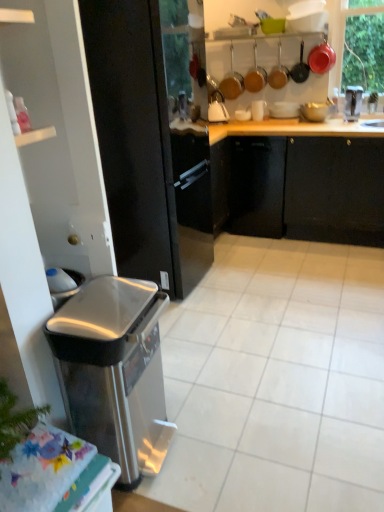
Question: Is matte red pot at upper right, the sixth appliance positioned from the left, taller than white glossy bowl at upper center, the 3th appliance positioned from the left?

Choices:
 (A) no
 (B) yes

Answer: (B)

Question: From a real-world perspective, is matte red pot at upper right, the sixth appliance positioned from the left, positioned over white glossy bowl at upper center, which is the fifth appliance from right to left, based on gravity?

Choices:
 (A) yes
 (B) no

Answer: (A)

Question: Does matte red pot at upper right, marked as the second appliance in a right-to-left arrangement, have a larger size compared to white glossy bowl at upper center, the 3th appliance positioned from the left?

Choices:
 (A) no
 (B) yes

Answer: (B)

Question: Does matte red pot at upper right, marked as the second appliance in a right-to-left arrangement, lie in front of white glossy bowl at upper center, which is the fifth appliance from right to left?

Choices:
 (A) yes
 (B) no

Answer: (A)

Question: Considering the relative positions of matte red pot at upper right, the sixth appliance positioned from the left, and white glossy bowl at upper center, which is the fifth appliance from right to left, in the image provided, is matte red pot at upper right, the sixth appliance positioned from the left, to the right of white glossy bowl at upper center, which is the fifth appliance from right to left, from the viewer's perspective?

Choices:
 (A) yes
 (B) no

Answer: (A)

Question: From the image's perspective, is matte white bowl at upper center, which is counted as the fifth appliance, starting from the left, located above or below metallic copper pot at upper center, arranged as the first appliance when viewed from the left?

Choices:
 (A) above
 (B) below

Answer: (B)

Question: Considering the positions of matte white bowl at upper center, which appears as the 3th appliance when viewed from the right, and metallic copper pot at upper center, arranged as the first appliance when viewed from the left, in the image, is matte white bowl at upper center, which appears as the 3th appliance when viewed from the right, bigger or smaller than metallic copper pot at upper center, arranged as the first appliance when viewed from the left,?

Choices:
 (A) small
 (B) big

Answer: (A)

Question: Considering the positions of point (301, 110) and point (223, 83), is point (301, 110) closer or farther from the camera than point (223, 83)?

Choices:
 (A) farther
 (B) closer

Answer: (B)

Question: From their relative heights in the image, would you say matte white bowl at upper center, which appears as the 3th appliance when viewed from the right, is taller or shorter than metallic copper pot at upper center, arranged as the first appliance when viewed from the left?

Choices:
 (A) tall
 (B) short

Answer: (B)

Question: Based on their positions, is black glossy refrigerator at left located to the left or right of matte brown pot at upper center, positioned as the 2th appliance in left-to-right order?

Choices:
 (A) left
 (B) right

Answer: (A)

Question: Is black glossy refrigerator at left bigger or smaller than matte brown pot at upper center, acting as the sixth appliance starting from the right?

Choices:
 (A) small
 (B) big

Answer: (B)

Question: Is black glossy refrigerator at left situated inside matte brown pot at upper center, acting as the sixth appliance starting from the right, or outside?

Choices:
 (A) inside
 (B) outside

Answer: (B)

Question: Considering the positions of black glossy refrigerator at left and matte brown pot at upper center, acting as the sixth appliance starting from the right, in the image, is black glossy refrigerator at left wider or thinner than matte brown pot at upper center, acting as the sixth appliance starting from the right,?

Choices:
 (A) wide
 (B) thin

Answer: (A)

Question: In the image, is black glossy refrigerator at left positioned in front of or behind white glossy sink at upper right?

Choices:
 (A) front
 (B) behind

Answer: (A)

Question: From the image's perspective, is black glossy refrigerator at left above or below white glossy sink at upper right?

Choices:
 (A) below
 (B) above

Answer: (A)